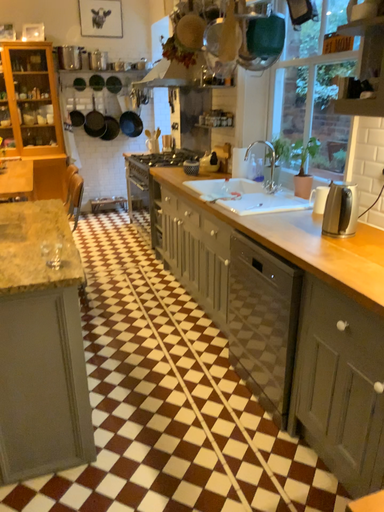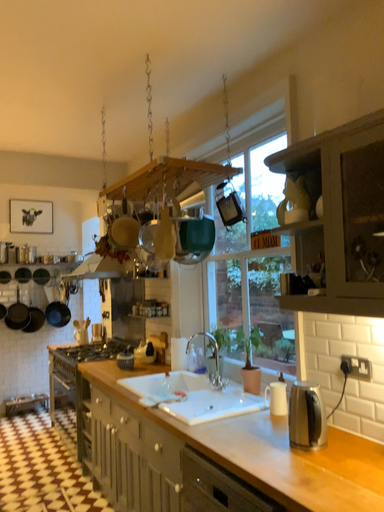
Question: Which way did the camera rotate in the video?

Choices:
 (A) rotated right
 (B) rotated left

Answer: (A)